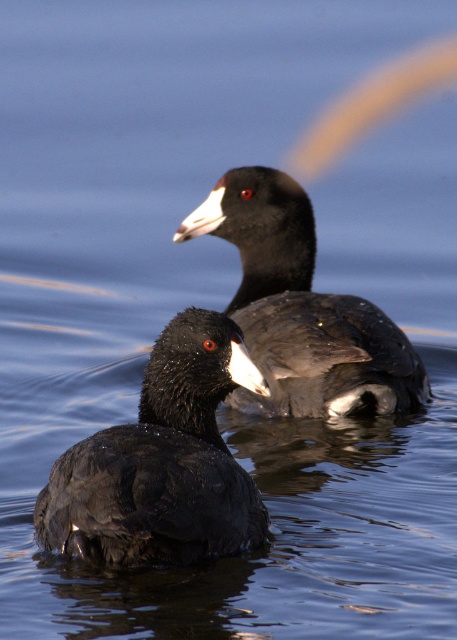
Does point (90, 512) come behind point (234, 230)?

That is False.

Is black matte duck at center thinner than shiny black duck at center?

Indeed, black matte duck at center has a lesser width compared to shiny black duck at center.

The width and height of the screenshot is (457, 640). What are the coordinates of `black matte duck at center` in the screenshot? It's located at (161, 461).